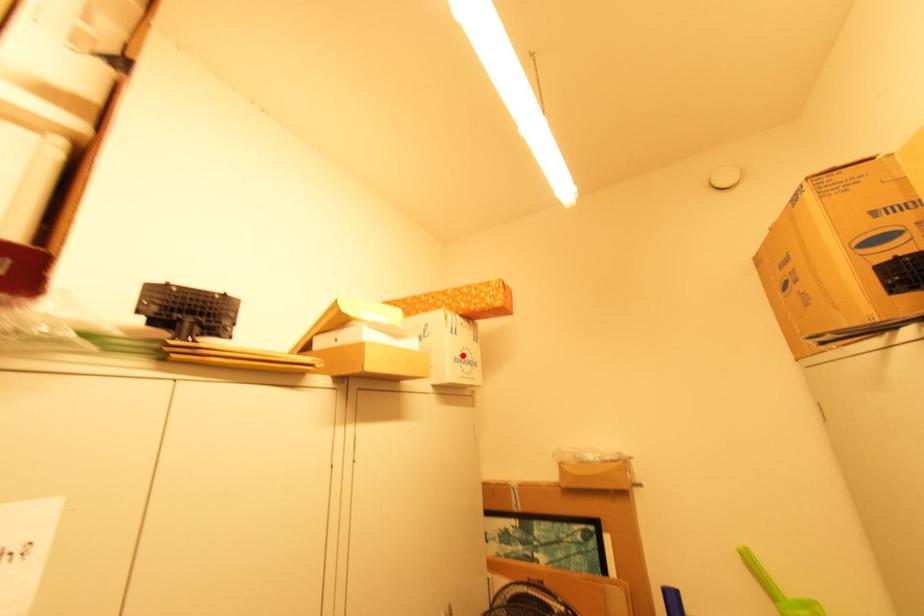
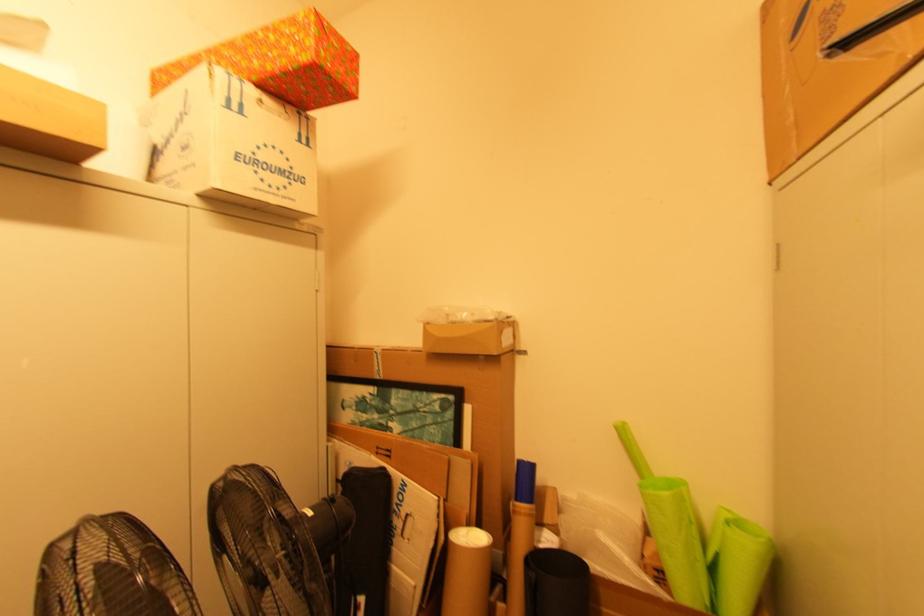
The point at the highlighted location is marked in the first image. Where is the corresponding point in the second image?

(257, 154)